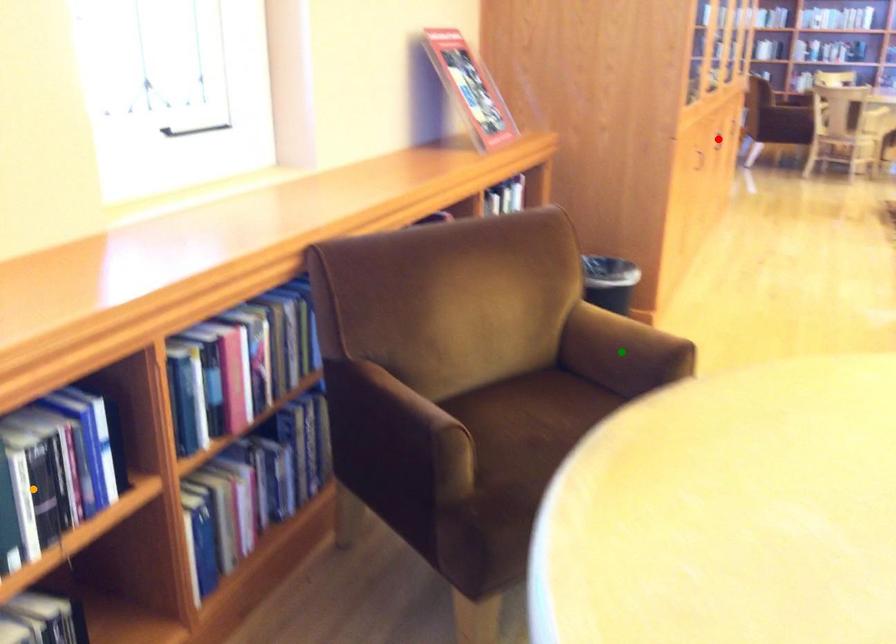
Order these from nearest to farthest:
red point | green point | orange point

orange point < green point < red point